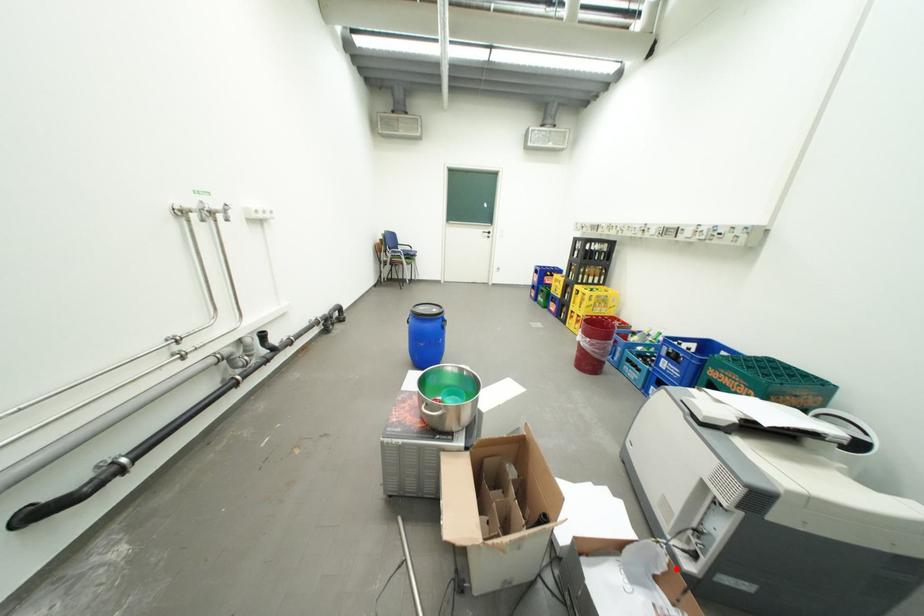
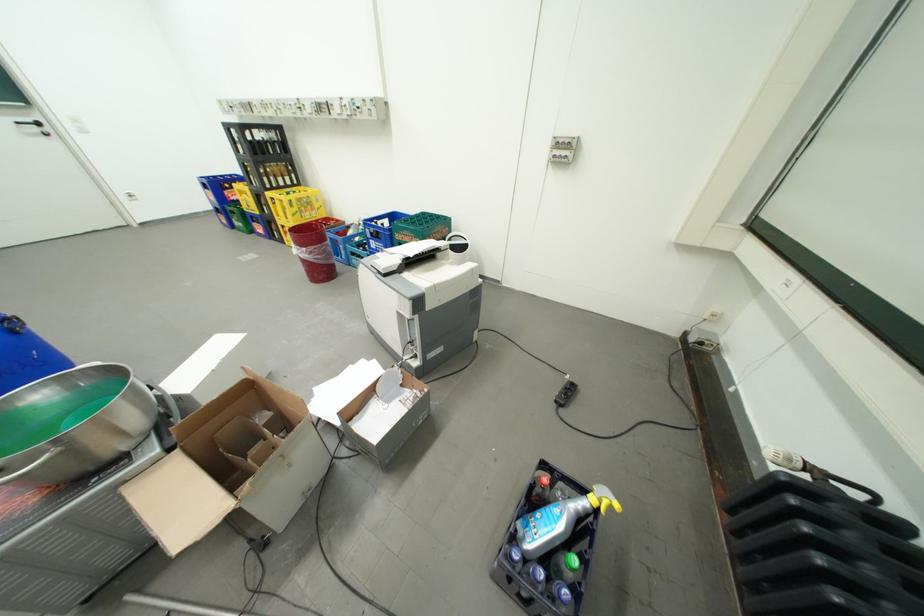
Question: I am providing you with two images of the same scene from different viewpoints. In image1, a red point is highlighted. Considering the same 3D point in image2, which of the following is correct?

Choices:
 (A) It is closer
 (B) It is farther

Answer: (A)